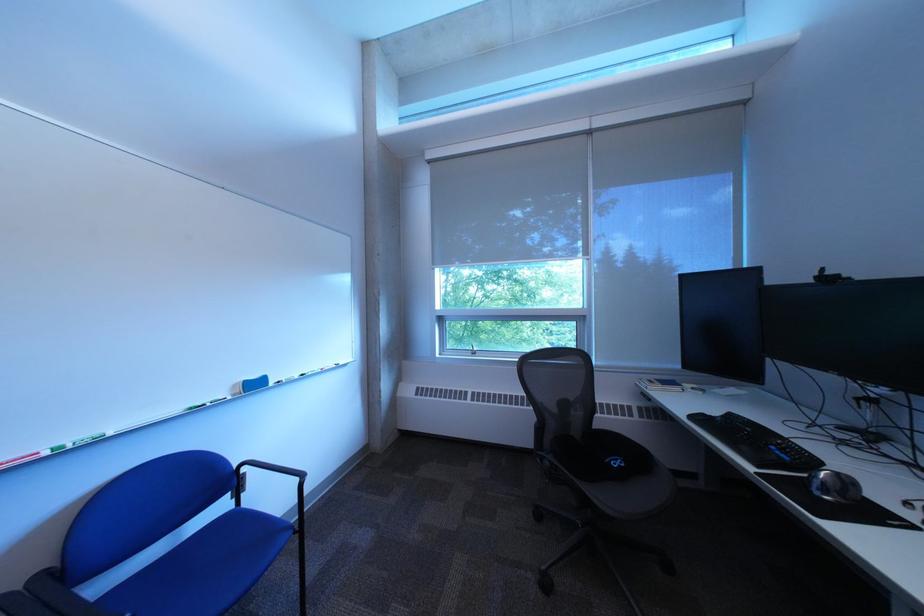
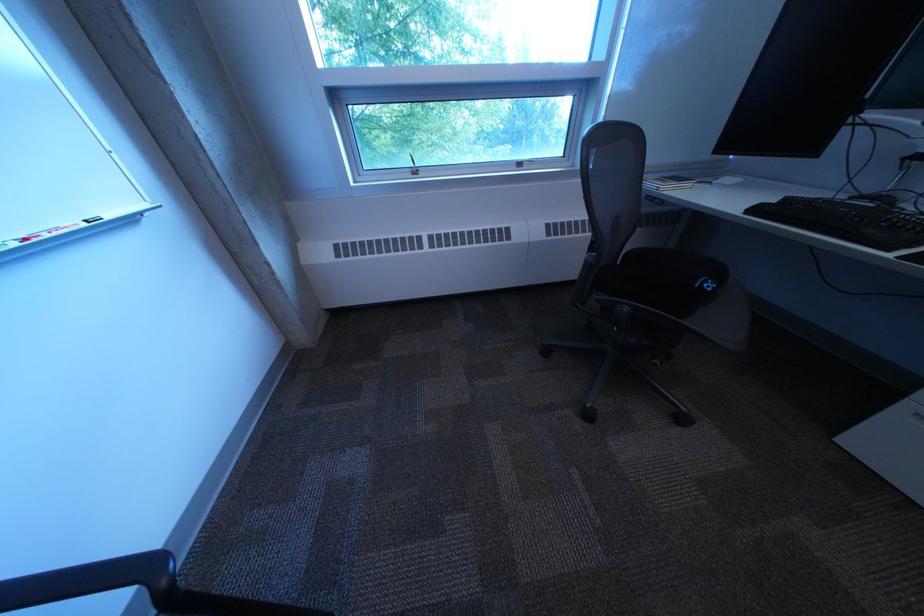
How did the camera likely rotate?

The camera rotated toward right-down.